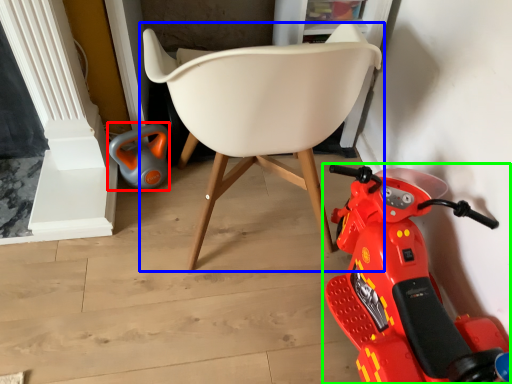
Question: Which object is positioned farthest from toy (highlighted by a red box)? Select from chair (highlighted by a blue box) and land vehicle (highlighted by a green box).

Choices:
 (A) chair
 (B) land vehicle

Answer: (B)